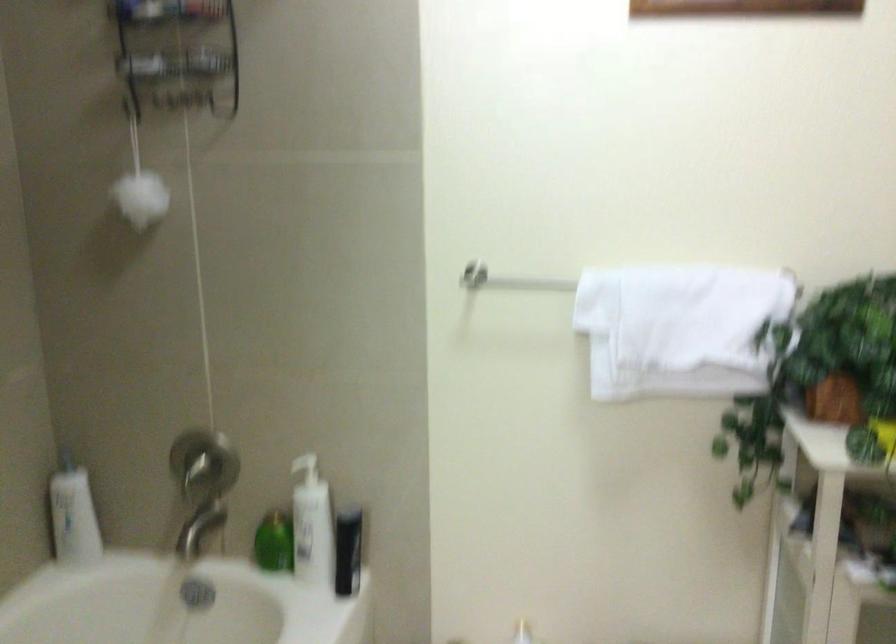
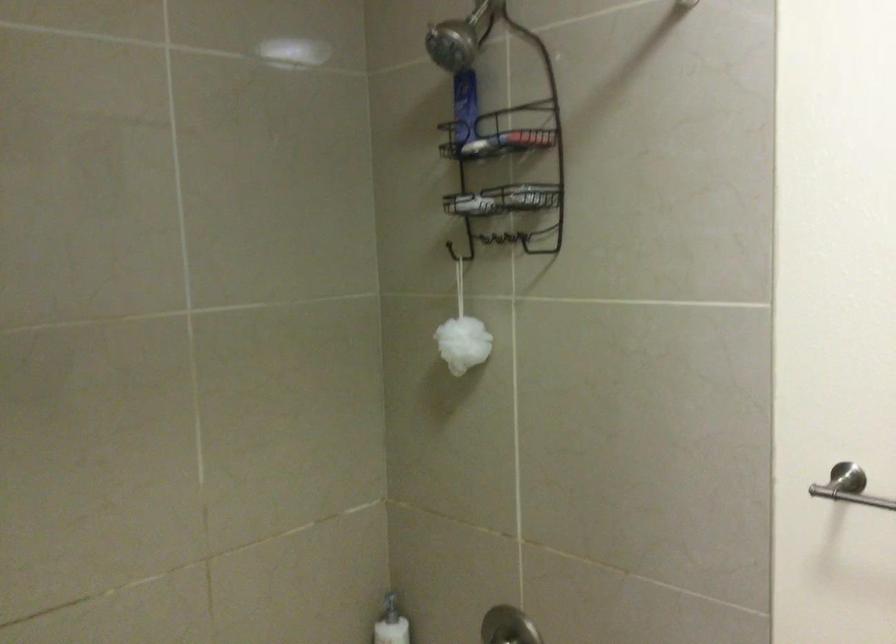
Where in the second image is the point corresponding to (x=153, y=192) from the first image?

(462, 343)